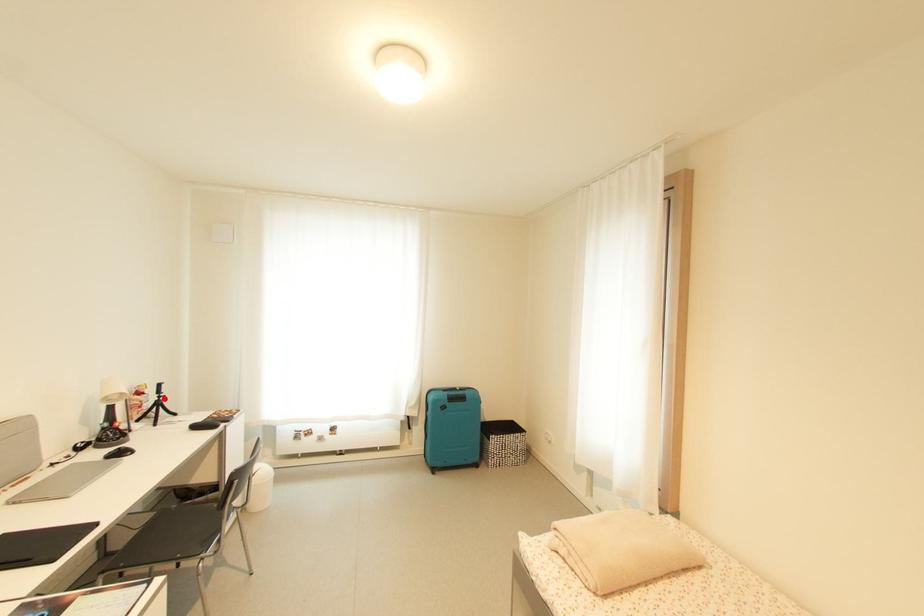
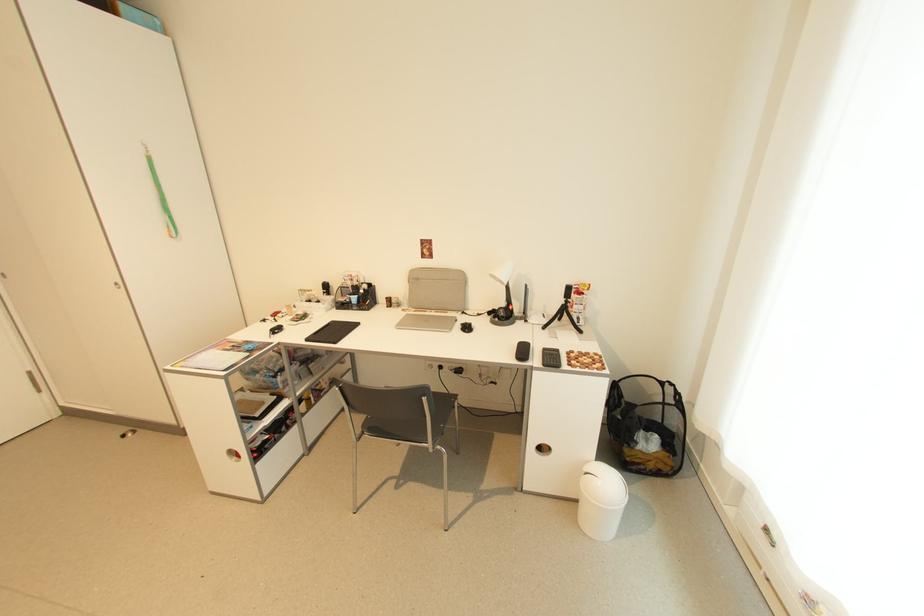
In the second image, find the point that corresponds to the highlighted location in the first image.

(572, 302)